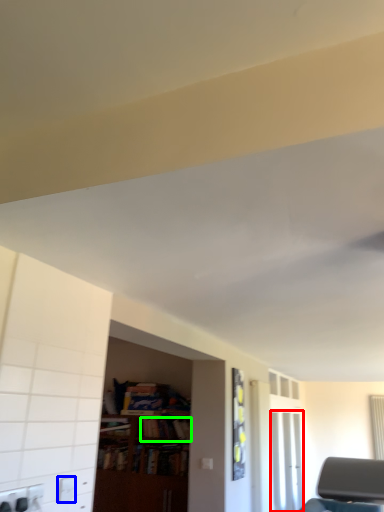
Question: Considering the real-world distances, which object is closest to glass door (highlighted by a red box)? electric outlet (highlighted by a blue box) or book (highlighted by a green box).

Choices:
 (A) electric outlet
 (B) book

Answer: (B)